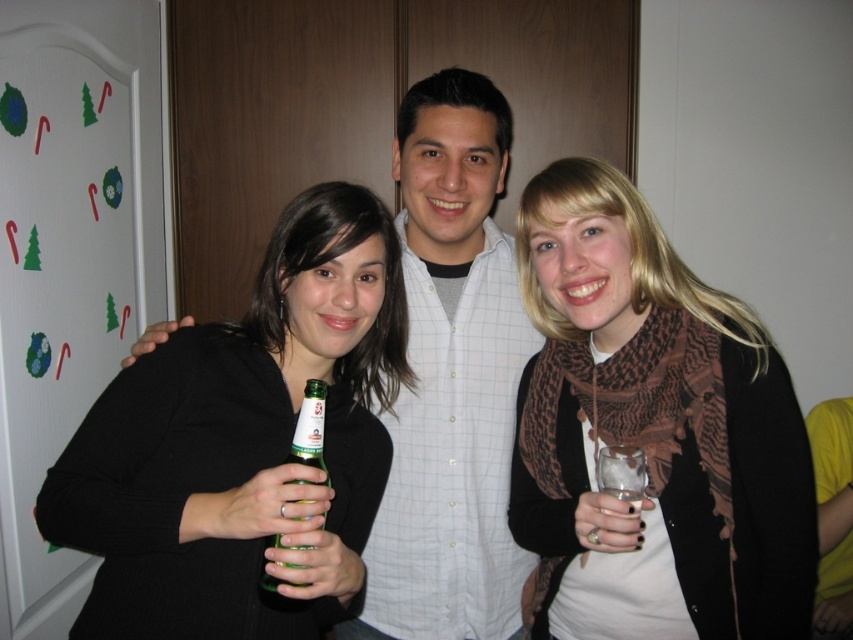
Is black matte shirt at left wider than clear glass at center?

Yes, black matte shirt at left is wider than clear glass at center.

Who is more distant from viewer, [270,272] or [633,513]?

Positioned behind is point [270,272].

Where is `black matte shirt at left`? black matte shirt at left is located at coordinates (241, 442).

Does brown textured scarf at right appear under clear glass at center?

Actually, brown textured scarf at right is above clear glass at center.

Does brown textured scarf at right have a greater height compared to clear glass at center?

Yes.

Between point (525, 220) and point (619, 541), which one is positioned behind?

Point (525, 220)

The width and height of the screenshot is (853, 640). Find the location of `brown textured scarf at right`. brown textured scarf at right is located at coordinates (654, 416).

What do you see at coordinates (241, 442) in the screenshot?
I see `black matte shirt at left` at bounding box center [241, 442].

Is black matte shirt at left shorter than white checkered shirt at center?

Indeed, black matte shirt at left has a lesser height compared to white checkered shirt at center.

You are a GUI agent. You are given a task and a screenshot of the screen. Output one action in this format:
    pyautogui.click(x=<x>, y=<y>)
    Task: Click on the black matte shirt at left
    This screenshot has width=853, height=640.
    Given the screenshot: What is the action you would take?
    pyautogui.click(x=241, y=442)

What are the coordinates of `black matte shirt at left` in the screenshot? It's located at (241, 442).